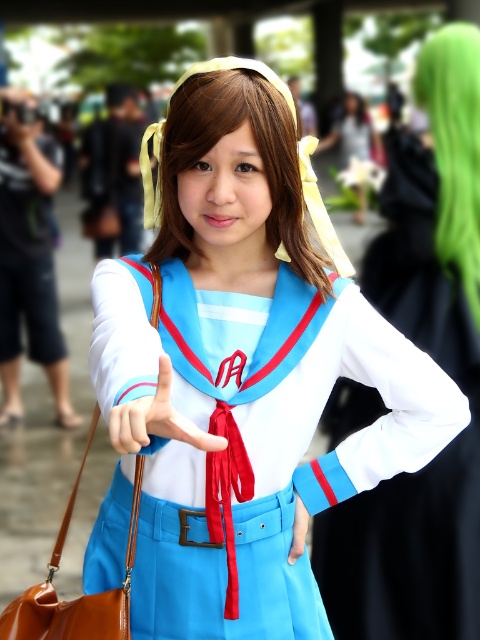
Question: Which of the following is the closest to the observer?

Choices:
 (A) (58, 544)
 (B) (265, 612)
 (C) (316, 282)
 (D) (133, 440)

Answer: (D)

Question: Can you confirm if matte blue uniform at center is positioned above green synthetic wig at upper right?

Choices:
 (A) no
 (B) yes

Answer: (A)

Question: Among these points, which one is nearest to the camera?

Choices:
 (A) (168, 428)
 (B) (458, 93)
 (C) (299, 516)

Answer: (A)

Question: Which point is closer to the camera?

Choices:
 (A) brown leather bag at lower left
 (B) green synthetic wig at upper right
 (C) yellow fabric wig at center

Answer: (A)

Question: Does matte blue uniform at center have a larger size compared to matte white hand at center?

Choices:
 (A) no
 (B) yes

Answer: (B)

Question: Does white matte dress at center appear on the right side of matte blue glove at center?

Choices:
 (A) yes
 (B) no

Answer: (A)